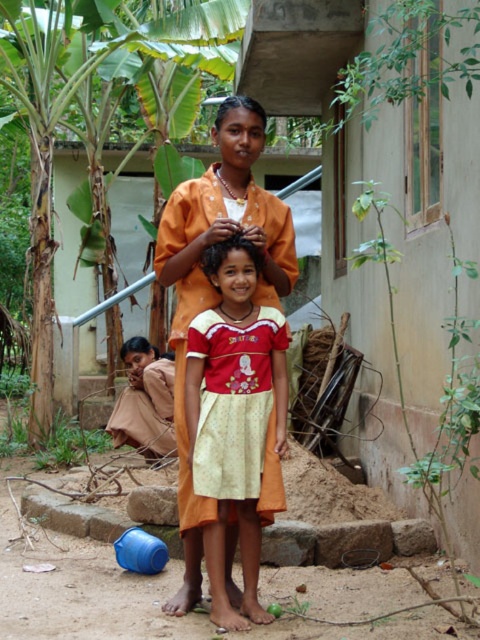
What do you see at coordinates (233, 413) in the screenshot?
I see `red cotton dress at center` at bounding box center [233, 413].

Between red cotton dress at center and brown silky hair at center, which one is positioned lower?

red cotton dress at center

Where is `red cotton dress at center`? red cotton dress at center is located at coordinates (233, 413).

Which is more to the left, green leafy banana tree at upper left or brown silky hair at center?

From the viewer's perspective, green leafy banana tree at upper left appears more on the left side.

Between green leafy banana tree at upper left and brown silky hair at center, which one is positioned lower?

brown silky hair at center

Locate an element on the screen. The width and height of the screenshot is (480, 640). green leafy banana tree at upper left is located at coordinates (61, 116).

Consider the image. Who is positioned more to the right, red cotton dress at center or green leafy banana tree at upper left?

From the viewer's perspective, red cotton dress at center appears more on the right side.

In the scene shown: Can you confirm if red cotton dress at center is bigger than green leafy banana tree at upper left?

Incorrect, red cotton dress at center is not larger than green leafy banana tree at upper left.

The image size is (480, 640). What are the coordinates of `red cotton dress at center` in the screenshot? It's located at (233, 413).